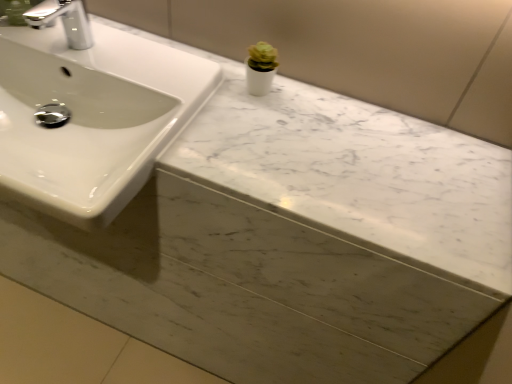
This screenshot has width=512, height=384. Identify the location of vacant area that is situated to the right of silver metallic faucet at upper left. (131, 60).